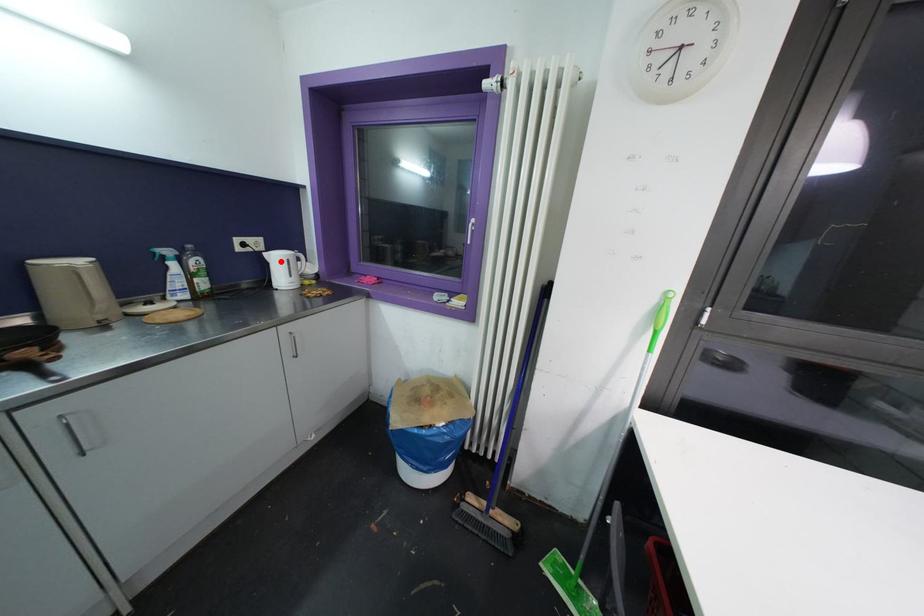
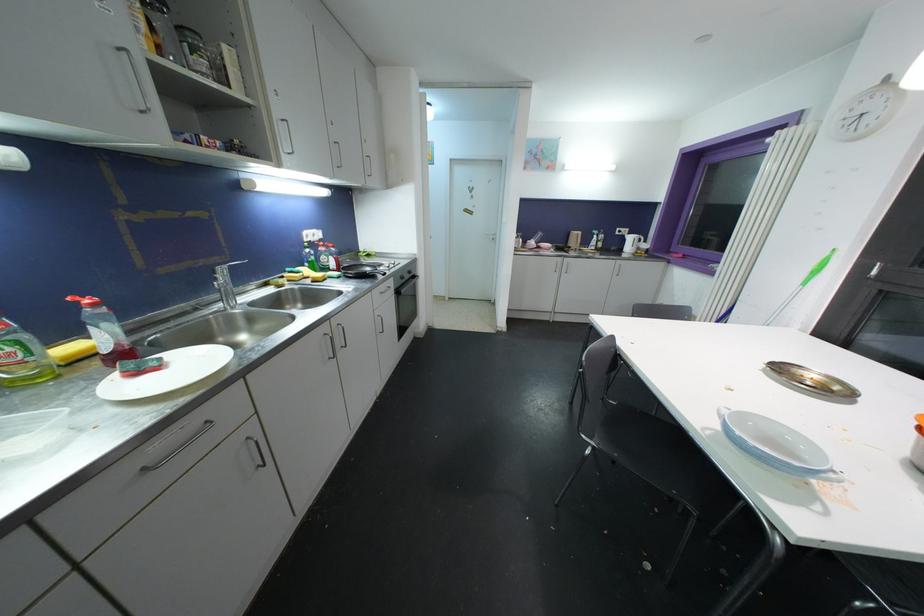
Find the pixel in the second image that matches the highlighted location in the first image.

(634, 241)